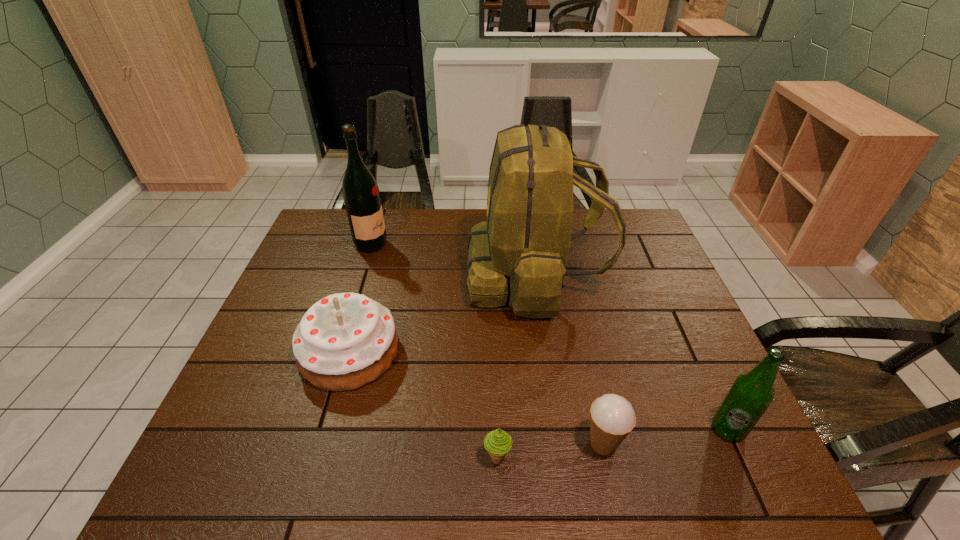
At what (x,y) coordinates should I click in order to perform the action: click on free space at the far edge of the desktop. Please return your answer as a coordinate pair (x, y). The width and height of the screenshot is (960, 540). Looking at the image, I should click on (584, 234).

Find the location of a particular element. free space at the near edge is located at coordinates (466, 488).

The height and width of the screenshot is (540, 960). In the image, there is a desktop. Identify the location of blank space at the left edge. (300, 258).

Where is `vacant space at the right edge of the desktop`? vacant space at the right edge of the desktop is located at coordinates (665, 267).

The width and height of the screenshot is (960, 540). I want to click on vacant space at the far left corner of the desktop, so click(337, 239).

Find the location of `free space between the liquor and the taller icecream`. free space between the liquor and the taller icecream is located at coordinates (487, 344).

I want to click on vacant region between the cake and the shorter icecream, so click(x=423, y=405).

At what (x,y) coordinates should I click in order to perform the action: click on free space between the shortest object and the backpack. Please return your answer as a coordinate pair (x, y). Looking at the image, I should click on (516, 367).

Image resolution: width=960 pixels, height=540 pixels. Find the location of `empty space that is in between the backpack and the liquor`. empty space that is in between the backpack and the liquor is located at coordinates (453, 260).

Find the location of a particular element. The height and width of the screenshot is (540, 960). empty space that is in between the rightmost object and the right icecream is located at coordinates (665, 436).